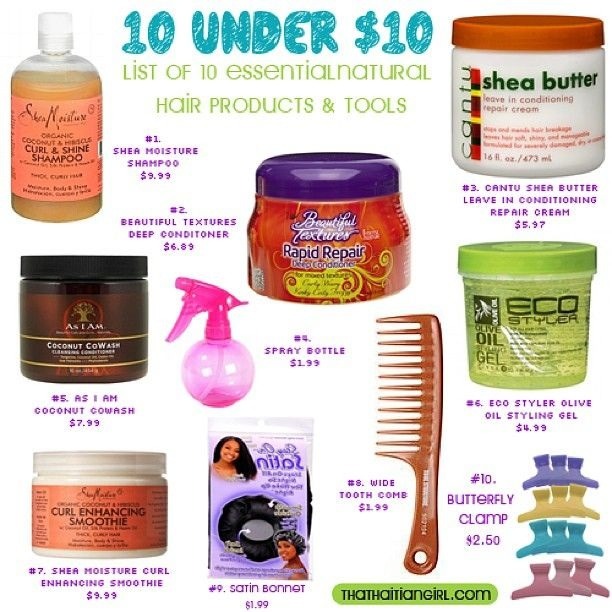
Identify the location of jars. (526, 83), (524, 330), (346, 233), (97, 293), (97, 506).